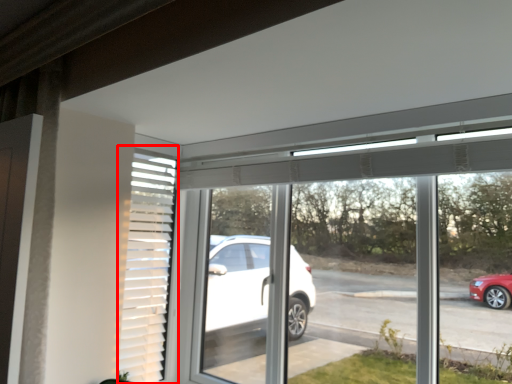
Question: Considering the relative positions of shutter (annotated by the red box) and window in the image provided, where is shutter (annotated by the red box) located with respect to the staircase?

Choices:
 (A) left
 (B) right

Answer: (A)